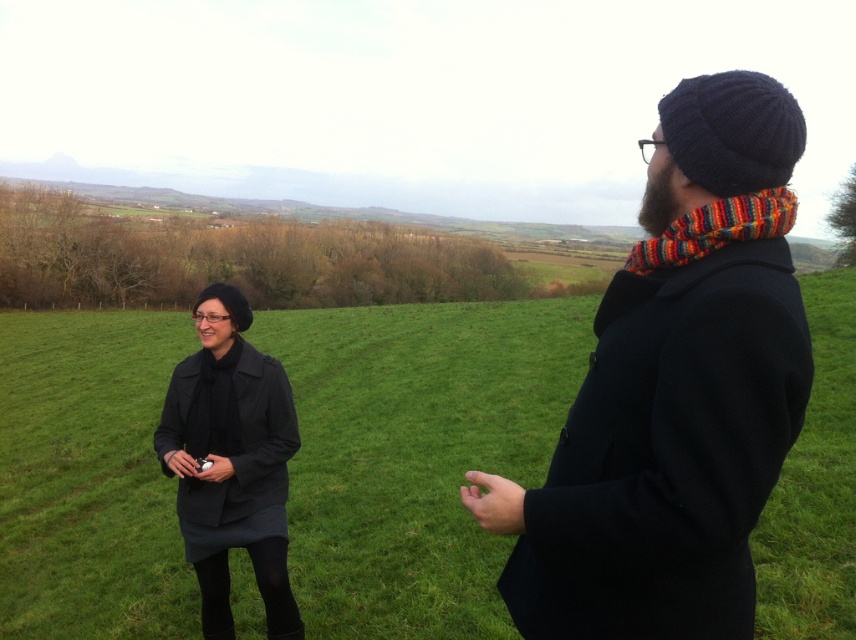
Question: Which of the following is the closest to the observer?

Choices:
 (A) (747, 200)
 (B) (179, 456)
 (C) (108, 323)
 (D) (568, 544)

Answer: (D)

Question: Where is knitted woolen hat at upper right located in relation to knitted multicolored scarf at right in the image?

Choices:
 (A) above
 (B) below

Answer: (B)

Question: Can you confirm if green grassy field at center is positioned to the left of matte black coat at left?

Choices:
 (A) yes
 (B) no

Answer: (B)

Question: Which point is farther to the camera?

Choices:
 (A) knitted multicolored scarf at right
 (B) matte black coat at left
 (C) knitted woolen hat at upper right
 (D) green grassy field at center

Answer: (B)

Question: Is green grassy field at center to the right of matte black coat at left from the viewer's perspective?

Choices:
 (A) yes
 (B) no

Answer: (A)

Question: Which point is farther to the camera?

Choices:
 (A) green grassy field at center
 (B) matte black coat at left
 (C) knitted multicolored scarf at right
 (D) knitted woolen hat at upper right

Answer: (B)